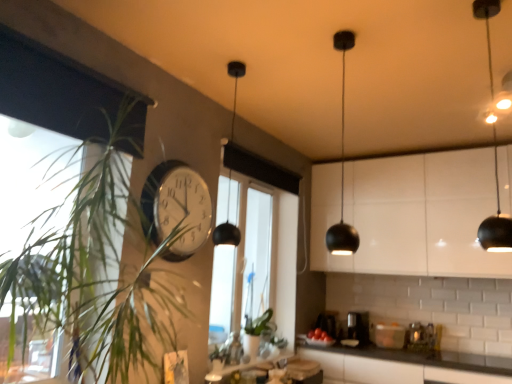
Question: Are green leafy plant at left and red glossy tomatoes at lower center making contact?

Choices:
 (A) yes
 (B) no

Answer: (B)

Question: From a real-world perspective, is green leafy plant at left on red glossy tomatoes at lower center?

Choices:
 (A) no
 (B) yes

Answer: (B)

Question: Can you confirm if green leafy plant at left is smaller than red glossy tomatoes at lower center?

Choices:
 (A) yes
 (B) no

Answer: (B)

Question: Does green leafy plant at left turn towards red glossy tomatoes at lower center?

Choices:
 (A) yes
 (B) no

Answer: (B)

Question: Considering the relative sizes of green leafy plant at left and red glossy tomatoes at lower center in the image provided, is green leafy plant at left thinner than red glossy tomatoes at lower center?

Choices:
 (A) no
 (B) yes

Answer: (A)

Question: Considering the relative sizes of green leafy plant at left and red glossy tomatoes at lower center in the image provided, is green leafy plant at left bigger than red glossy tomatoes at lower center?

Choices:
 (A) no
 (B) yes

Answer: (B)

Question: Can you confirm if red glossy tomatoes at lower center is smaller than white glossy cabinet at upper right?

Choices:
 (A) yes
 (B) no

Answer: (A)

Question: From the image's perspective, is red glossy tomatoes at lower center located beneath white glossy cabinet at upper right?

Choices:
 (A) no
 (B) yes

Answer: (B)

Question: Could white glossy cabinet at upper right be considered to be inside red glossy tomatoes at lower center?

Choices:
 (A) yes
 (B) no

Answer: (B)

Question: Is red glossy tomatoes at lower center beside white glossy cabinet at upper right?

Choices:
 (A) no
 (B) yes

Answer: (A)

Question: Is red glossy tomatoes at lower center in front of white glossy cabinet at upper right?

Choices:
 (A) no
 (B) yes

Answer: (A)

Question: Does red glossy tomatoes at lower center have a greater width compared to white glossy cabinet at upper right?

Choices:
 (A) yes
 (B) no

Answer: (B)

Question: From a real-world perspective, is black matte pendant light at upper right located beneath black matte pendant light at upper center?

Choices:
 (A) no
 (B) yes

Answer: (A)